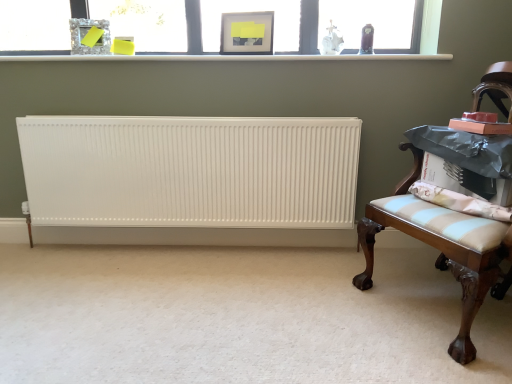
Question: Based on their sizes in the image, would you say mahogany wood bench at right is bigger or smaller than matte glass picture frame at upper center, which is the 1th picture frame in right-to-left order?

Choices:
 (A) small
 (B) big

Answer: (B)

Question: From a real-world perspective, is mahogany wood bench at right physically located above or below matte glass picture frame at upper center, placed as the second picture frame when sorted from left to right?

Choices:
 (A) below
 (B) above

Answer: (A)

Question: Which object is positioned closest to the mahogany wood bench at right?

Choices:
 (A) crystal glass picture frame at upper center, marked as the second picture frame in a right-to-left arrangement
 (B) light blue striped cushion at right
 (C) matte glass picture frame at upper center, which is the 1th picture frame in right-to-left order
 (D) white plastic window sill at upper center
 (E) clear glass window at upper center

Answer: (B)

Question: Which is farther from the clear glass window at upper center?

Choices:
 (A) white ribbed radiator at center
 (B) white matte radiator at lower left
 (C) mahogany wood bench at right
 (D) matte glass picture frame at upper center, which is the 1th picture frame in right-to-left order
 (E) light blue striped cushion at right

Answer: (B)